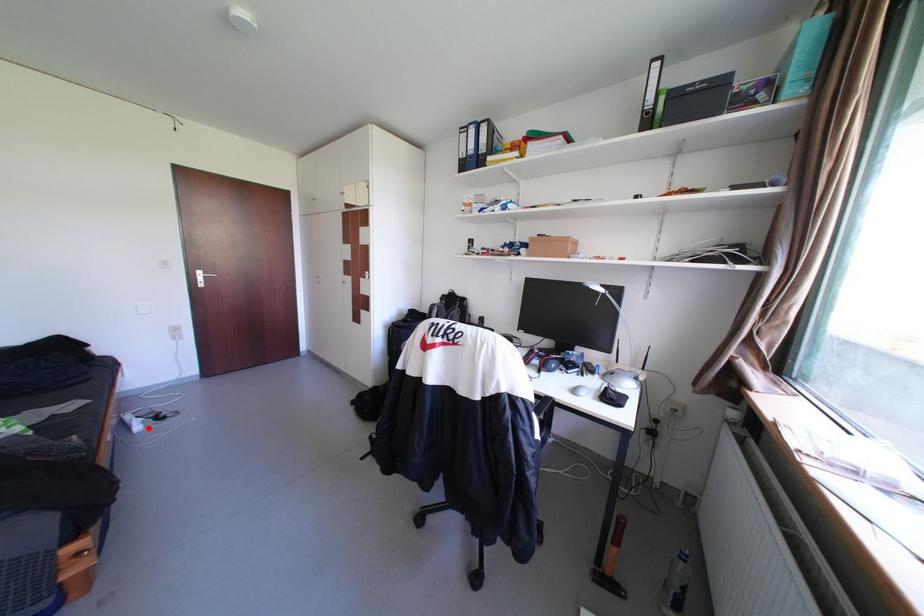
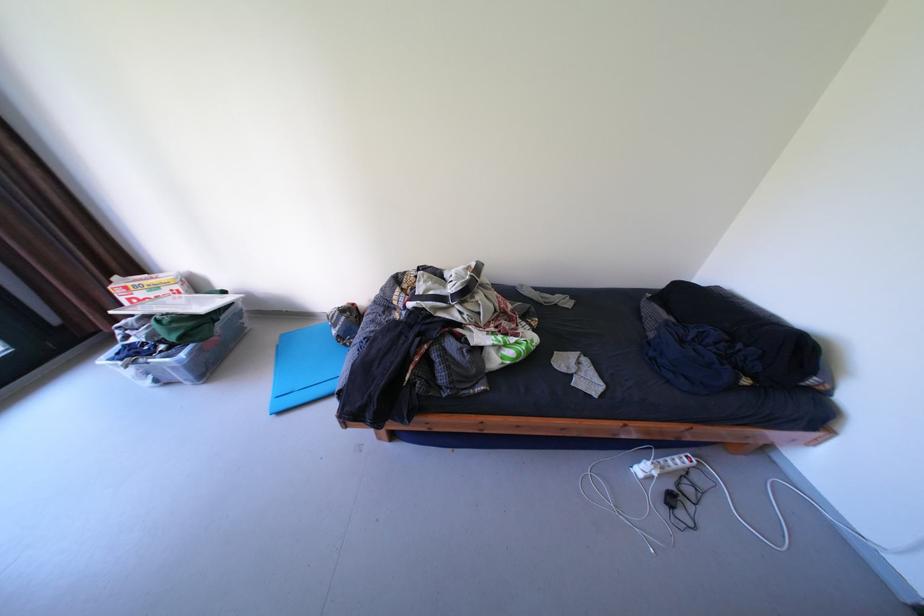
Question: I am providing you with two images of the same scene from different viewpoints. A red point is marked on the first image. At the location where the point appears in image 1, is it still visible in image 2?

Choices:
 (A) Yes
 (B) No

Answer: (A)